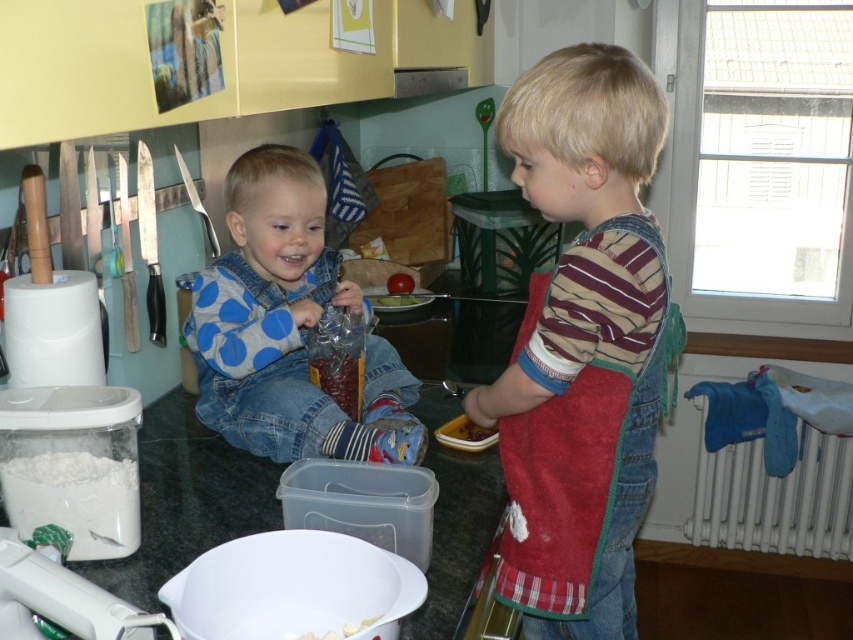
Question: Which of the following is the farthest from the observer?

Choices:
 (A) blue dotted shirt at center
 (B) shiny plastic container at center
 (C) striped cotton shirt at center
 (D) white powder at lower left

Answer: (B)

Question: Which of these objects is positioned farthest from the striped cotton shirt at center?

Choices:
 (A) shiny plastic container at center
 (B) red matte apple at center

Answer: (B)

Question: Which of the following is the closest to the observer?

Choices:
 (A) shiny plastic container at center
 (B) striped cotton shirt at center

Answer: (B)

Question: Considering the relative positions of white creamy cheese at lower center and red matte apple at center in the image provided, where is white creamy cheese at lower center located with respect to red matte apple at center?

Choices:
 (A) below
 (B) above

Answer: (A)

Question: Does white powder at lower left have a smaller size compared to shiny plastic container at center?

Choices:
 (A) yes
 (B) no

Answer: (B)

Question: Can you confirm if white creamy cheese at lower center is smaller than red matte apple at center?

Choices:
 (A) yes
 (B) no

Answer: (B)